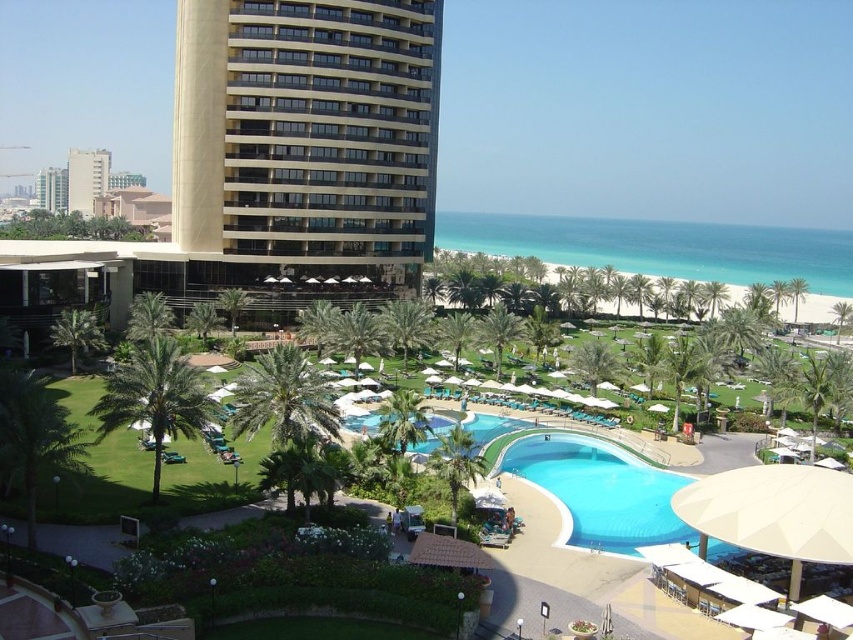
You are a guest staying at the resort and want to take a photo of both the beige textured building at upper left and the blue glossy pool at center from your balcony. Considering their sizes, which one would appear bigger in your photo?

The beige textured building at upper left would appear bigger in the photo because it is larger in size than the blue glossy pool at center.

You are a guest staying at the resort and want to take a photo of the beige textured building at upper left from the blue glossy pool at center. Can you see the entire building from the pool area?

The beige textured building at upper left is above the blue glossy pool at center, so yes, you can see the entire building from the pool area as it is positioned higher up.

You are a guest staying at the resort and want to take a photo of the beige textured building at upper left from the blue glossy pool at center. Considering their heights, will the building block your view of the sky in the photo?

The beige textured building at upper left is taller than the blue glossy pool at center, so when taking a photo from the pool area, the building may block part of the sky depending on the angle and distance. However, since the building is at the upper left and the pool is at the center, there might still be space to frame the shot without full obstruction.